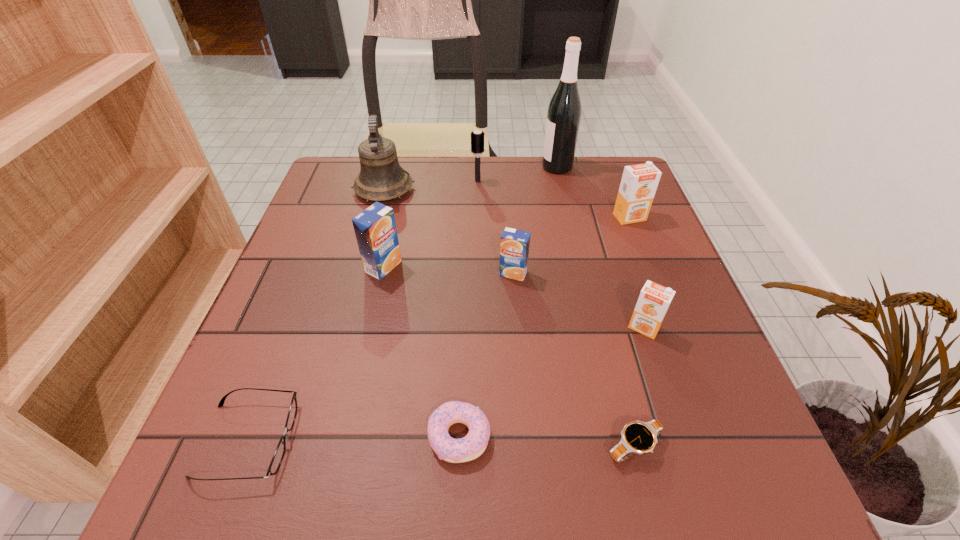
Where is `the tallest object`? The width and height of the screenshot is (960, 540). the tallest object is located at coordinates pyautogui.click(x=564, y=112).

Where is `wine bottle`? This screenshot has height=540, width=960. wine bottle is located at coordinates (564, 112).

Find the location of `the second tallest object`. the second tallest object is located at coordinates (381, 178).

This screenshot has width=960, height=540. I want to click on hairbrush, so click(477, 137).

You are a GUI agent. You are given a task and a screenshot of the screen. Output one action in this format:
    pyautogui.click(x=<x>, y=<y>)
    Task: Click on the farthest orange juice
    Image resolution: width=960 pixels, height=540 pixels.
    Given the screenshot: What is the action you would take?
    pyautogui.click(x=639, y=182)

Image resolution: width=960 pixels, height=540 pixels. I want to click on the seventh nearest object, so click(639, 182).

In order to click on the leftmost orange juice in this screenshot , I will do `click(375, 228)`.

I want to click on the bigger blue orange_juice, so click(x=375, y=228).

Where is `the right blue orange_juice`? This screenshot has width=960, height=540. the right blue orange_juice is located at coordinates (514, 249).

I want to click on the smaller blue orange_juice, so coord(514,249).